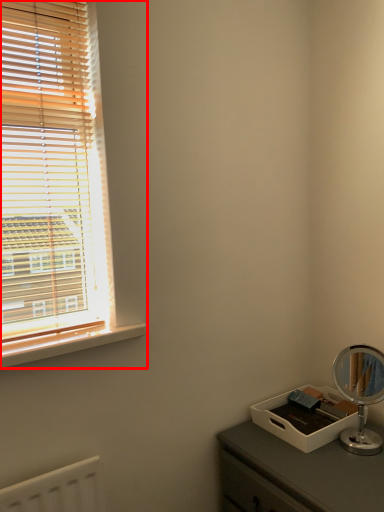
Question: From the image's perspective, what is the correct spatial positioning of window (annotated by the red box) in reference to window sill?

Choices:
 (A) above
 (B) below

Answer: (A)